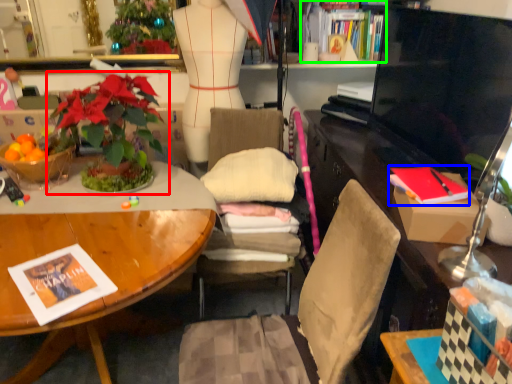
Question: Which object is the closest to the houseplant (highlighted by a red box)? Choose among these: magazine (highlighted by a blue box) or book (highlighted by a green box).

Choices:
 (A) magazine
 (B) book

Answer: (A)